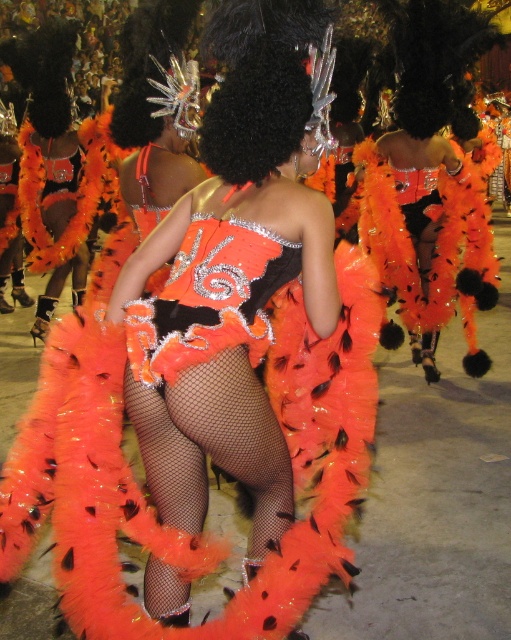
Can you confirm if orange feathered costume at center is positioned to the left of orange feather boa at center?

In fact, orange feathered costume at center is to the right of orange feather boa at center.

How much distance is there between orange feathered costume at center and orange feather boa at center?

They are 3.28 meters apart.

Is point (263, 241) behind point (96, 200)?

No, (263, 241) is in front of (96, 200).

Locate an element on the screen. The image size is (511, 640). orange feathered costume at center is located at coordinates (234, 291).